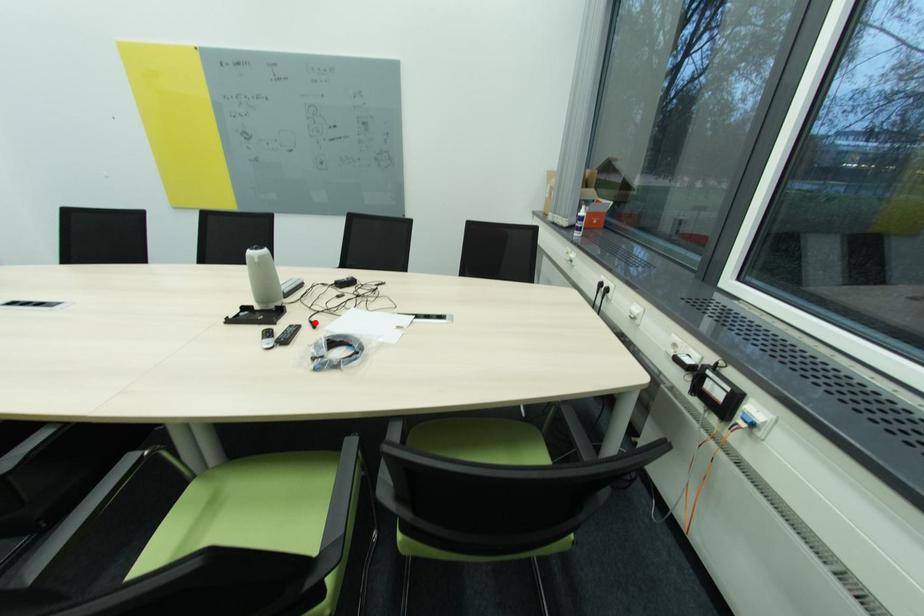
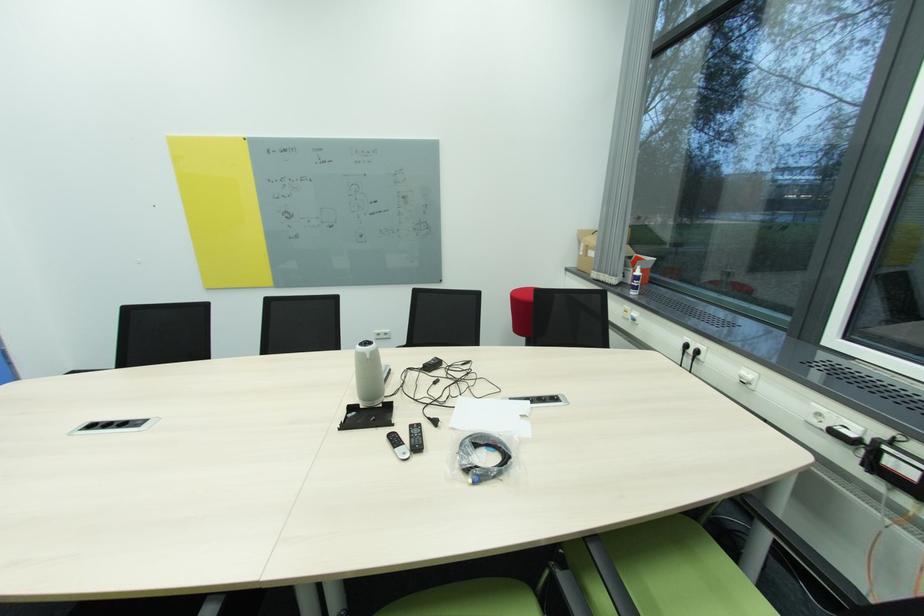
In the second image, find the point that corresponds to the highlighted location in the first image.

(433, 419)